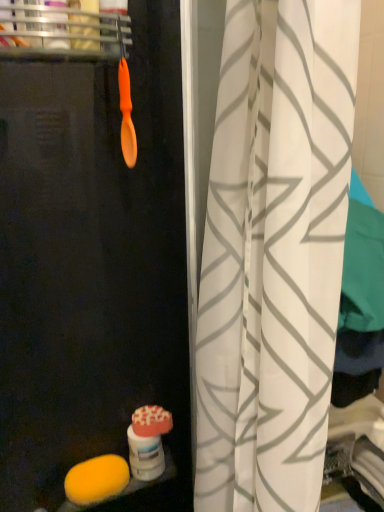
Question: Can you confirm if transparent plastic screen door at center is positioned to the right of orange matte spoon at upper left?

Choices:
 (A) no
 (B) yes

Answer: (B)

Question: Is transparent plastic screen door at center not within orange matte spoon at upper left?

Choices:
 (A) yes
 (B) no

Answer: (A)

Question: From a real-world perspective, is transparent plastic screen door at center positioned under orange matte spoon at upper left based on gravity?

Choices:
 (A) yes
 (B) no

Answer: (A)

Question: From the image's perspective, would you say transparent plastic screen door at center is shown under orange matte spoon at upper left?

Choices:
 (A) yes
 (B) no

Answer: (A)

Question: Can you confirm if transparent plastic screen door at center is positioned to the left of orange matte spoon at upper left?

Choices:
 (A) no
 (B) yes

Answer: (A)

Question: From a real-world perspective, is transparent plastic screen door at center located higher than orange matte spoon at upper left?

Choices:
 (A) no
 (B) yes

Answer: (A)

Question: Is the position of white fabric curtain at center more distant than that of orange plastic spoon at upper left?

Choices:
 (A) yes
 (B) no

Answer: (B)

Question: Is white fabric curtain at center in front of orange plastic spoon at upper left?

Choices:
 (A) no
 (B) yes

Answer: (B)

Question: Is white fabric curtain at center not within orange plastic spoon at upper left?

Choices:
 (A) no
 (B) yes

Answer: (B)

Question: Considering the relative sizes of white fabric curtain at center and orange plastic spoon at upper left in the image provided, is white fabric curtain at center bigger than orange plastic spoon at upper left?

Choices:
 (A) yes
 (B) no

Answer: (A)

Question: Is white fabric curtain at center at the right side of orange plastic spoon at upper left?

Choices:
 (A) no
 (B) yes

Answer: (B)

Question: Is white fabric curtain at center oriented away from orange plastic spoon at upper left?

Choices:
 (A) no
 (B) yes

Answer: (B)

Question: Can we say yellow sponge at lower left lies outside orange plastic spoon at upper left?

Choices:
 (A) yes
 (B) no

Answer: (A)